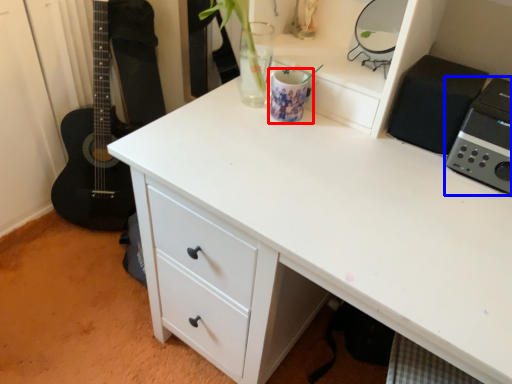
Question: Which object is further to the camera taking this photo, appliance (highlighted by a red box) or appliance (highlighted by a blue box)?

Choices:
 (A) appliance
 (B) appliance

Answer: (A)